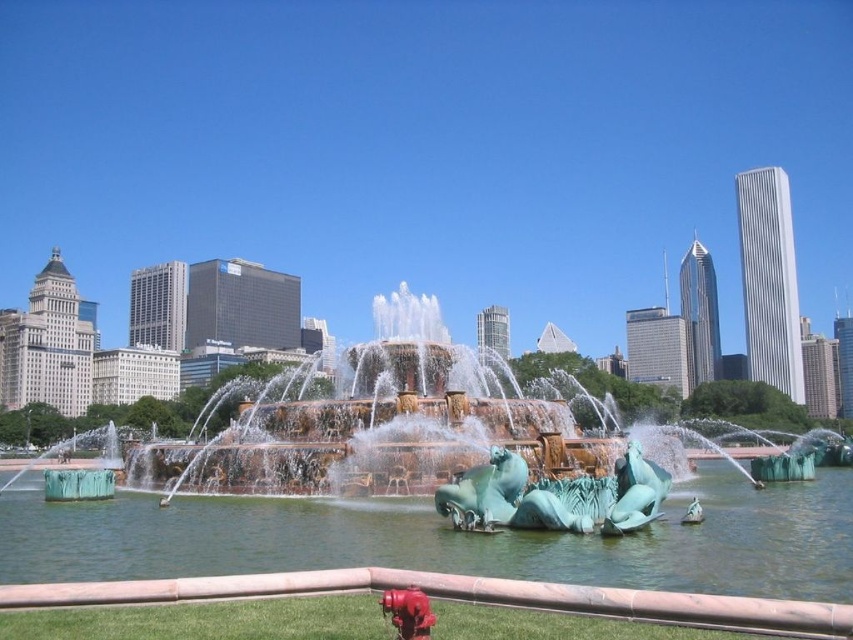
Does green marble horse at center have a lesser height compared to green patina horse at center?

No, green marble horse at center is not shorter than green patina horse at center.

Between point (485, 522) and point (608, 529), which one is positioned behind?

The point (485, 522) is behind.

What do you see at coordinates (485, 492) in the screenshot? Image resolution: width=853 pixels, height=640 pixels. I see `green marble horse at center` at bounding box center [485, 492].

Locate an element on the screen. This screenshot has width=853, height=640. green marble horse at center is located at coordinates (485, 492).

Between green patina horse at center and red matte hydrant at lower center, which one appears on the right side from the viewer's perspective?

Positioned to the right is green patina horse at center.

At what (x,y) coordinates should I click in order to perform the action: click on green patina horse at center. Please return your answer as a coordinate pair (x, y). The height and width of the screenshot is (640, 853). Looking at the image, I should click on (635, 492).

Is point (634, 525) farther from camera compared to point (393, 609)?

Yes, it is.

I want to click on green patina horse at center, so click(x=635, y=492).

Who is positioned more to the left, bronze sculpture at center or green marble horse at center?

Positioned to the left is bronze sculpture at center.

Does bronze sculpture at center appear under green marble horse at center?

Correct, bronze sculpture at center is located below green marble horse at center.

Does point (602, 561) come closer to viewer compared to point (488, 470)?

Yes, point (602, 561) is in front of point (488, 470).

Where is `bronze sculpture at center`? bronze sculpture at center is located at coordinates (438, 548).